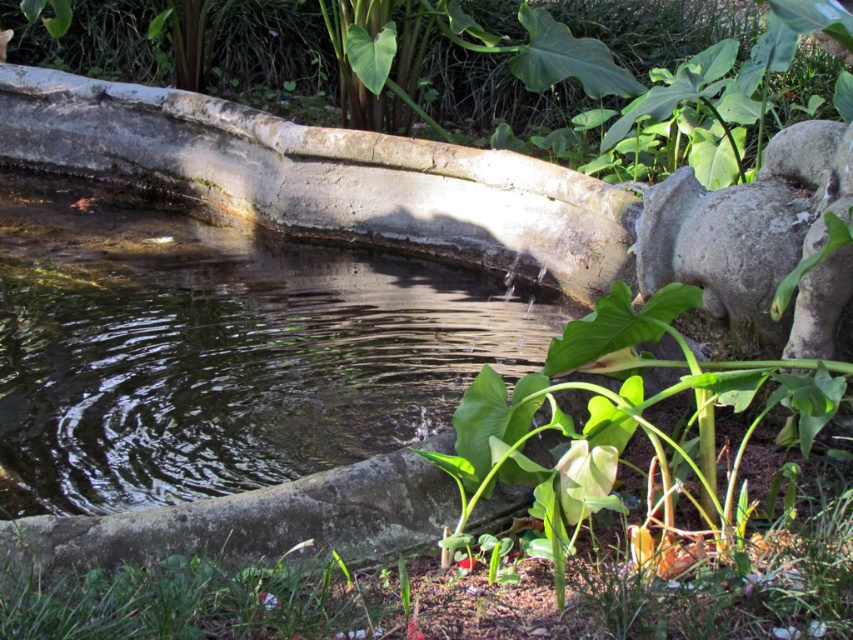
In the scene shown: You are standing in the garden and want to place a small statue exactly at the center of the water feature. The statue is 1 meter tall. Given the green leafy plant at upper center is located at coordinates 0.095, 0.537, can you determine if the statue will block the view of the plant from your current position?

The green leafy plant at upper center is located at coordinates (457, 60). Since the statue is placed at the center of the water feature, which is likely positioned differently from the plant, the statue may or may not block the view depending on the exact positioning. However, without additional spatial data about the water feature and statue placement relative to the plant, it is impossible to determine with certainty.

You are standing in the garden and want to water the green leafy plant at upper center. Your watering can has a range of 20 feet. Can you reach it without moving closer?

The green leafy plant at upper center is 24.05 feet away from the viewer, which is beyond the watering can range of 20 feet. You need to move closer to reach it.